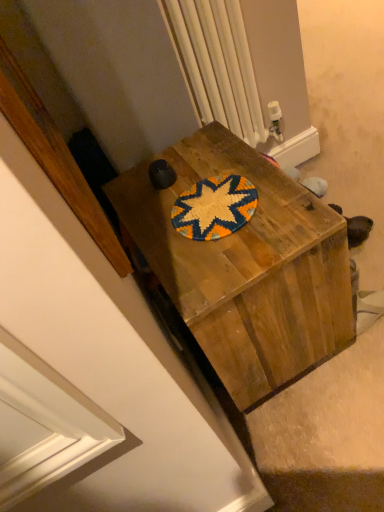
You are a GUI agent. You are given a task and a screenshot of the screen. Output one action in this format:
    pyautogui.click(x=<x>, y=<y>)
    Task: Click on the free space in front of wooden desk at center
    
    Given the screenshot: What is the action you would take?
    pyautogui.click(x=322, y=431)